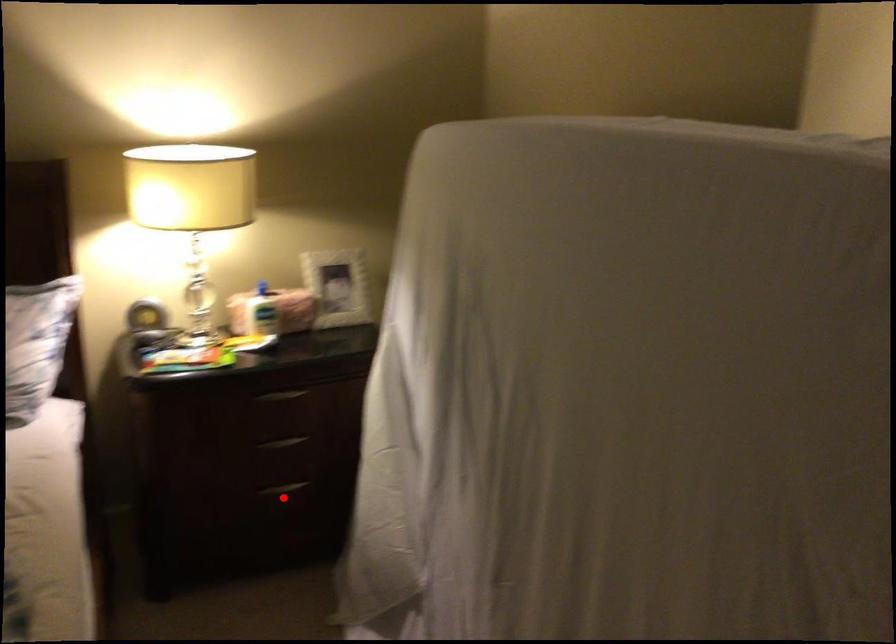
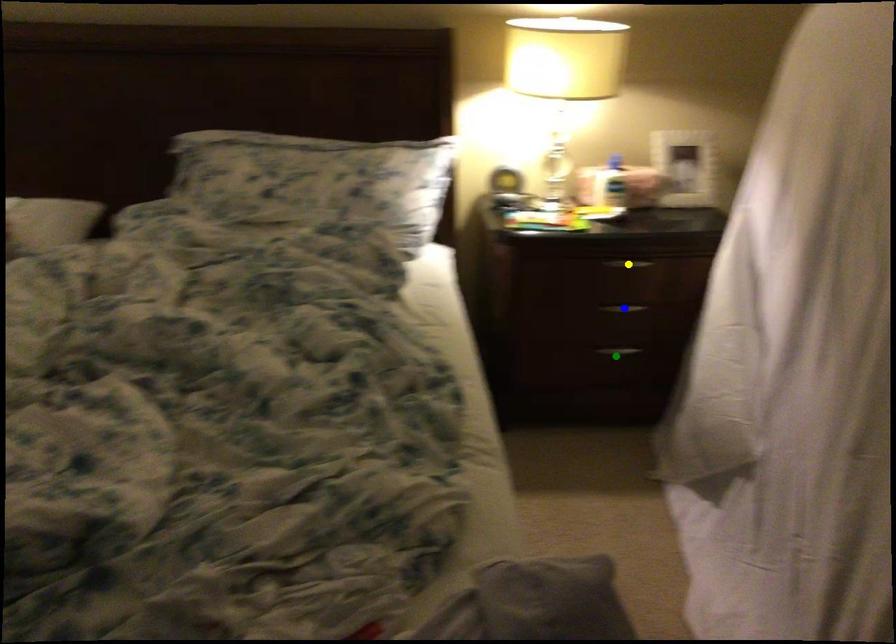
Question: I am providing you with two images of the same scene from different viewpoints. A red point is marked on the first image. You are given multiple points on the second image. Which point in image 2 represents the same 3d spot as the red point in image 1?

Choices:
 (A) blue point
 (B) green point
 (C) yellow point

Answer: (B)